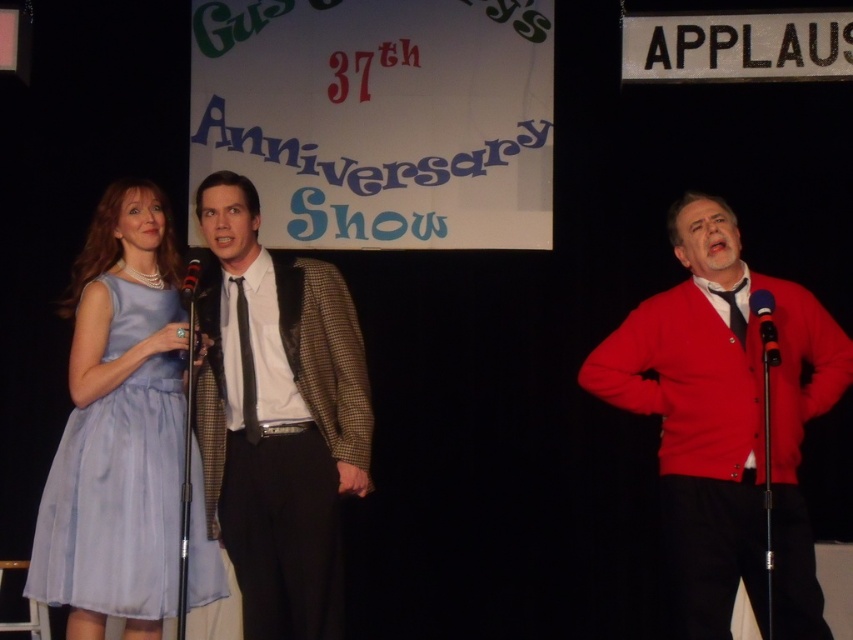
Question: Where is light blue chiffon dress at left located in relation to black plastic microphone at center in the image?

Choices:
 (A) below
 (B) above

Answer: (A)

Question: Which point is closer to the camera?

Choices:
 (A) (190, 260)
 (B) (169, 374)

Answer: (A)

Question: Which object is the farthest from the light blue chiffon dress at left?

Choices:
 (A) blue metallic microphone at right
 (B) black plastic microphone at center

Answer: (A)

Question: Is red cardigan at center below red cardigan at right?

Choices:
 (A) yes
 (B) no

Answer: (A)

Question: Estimate the real-world distances between objects in this image. Which object is closer to the houndstooth fabric blazer at center?

Choices:
 (A) black plastic microphone at center
 (B) blue metallic microphone at right
 (C) red cardigan at right

Answer: (A)

Question: Can you confirm if light blue chiffon dress at left is positioned to the right of black plastic microphone at center?

Choices:
 (A) yes
 (B) no

Answer: (B)